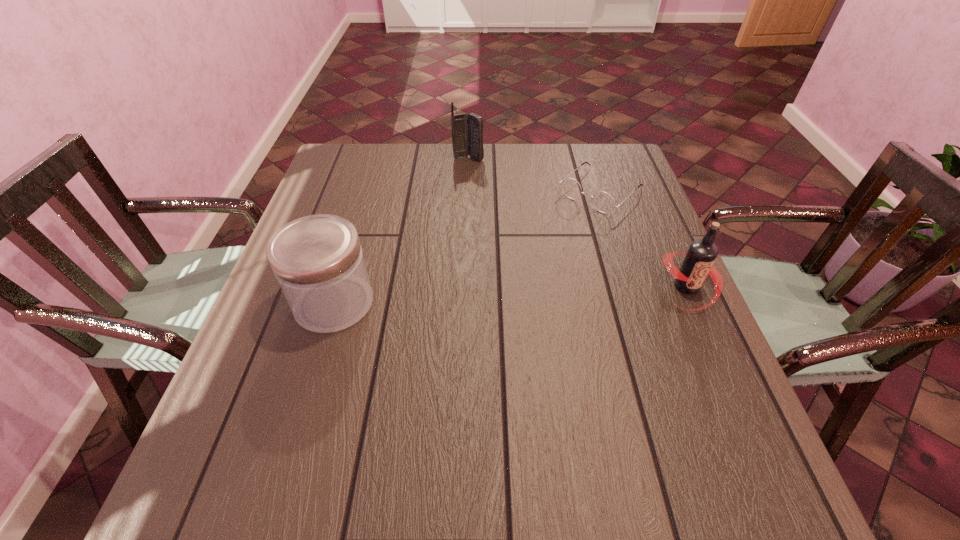
Identify the location of jar. The height and width of the screenshot is (540, 960). (318, 262).

Find the location of `root beer`. root beer is located at coordinates (698, 263).

What are the coordinates of `the shortest object` in the screenshot? It's located at (603, 201).

This screenshot has height=540, width=960. Identify the location of the second farthest object. (603, 201).

Where is `the farthest object`? This screenshot has height=540, width=960. the farthest object is located at coordinates (467, 131).

What are the coordinates of `the third object from right to left` in the screenshot? It's located at (467, 131).

I want to click on vacant point located on the right of the leftmost object, so click(x=419, y=303).

At what (x,y) coordinates should I click in order to perform the action: click on free location located on the label of the root beer. Please return your answer as a coordinate pair (x, y). This screenshot has width=960, height=540. Looking at the image, I should click on pyautogui.click(x=751, y=430).

The height and width of the screenshot is (540, 960). I want to click on vacant area situated 0.100m on the front-facing side of the shortest object, so click(x=558, y=230).

Identify the location of vacant space located 0.320m on the front-facing side of the shortest object. The height and width of the screenshot is (540, 960). (506, 277).